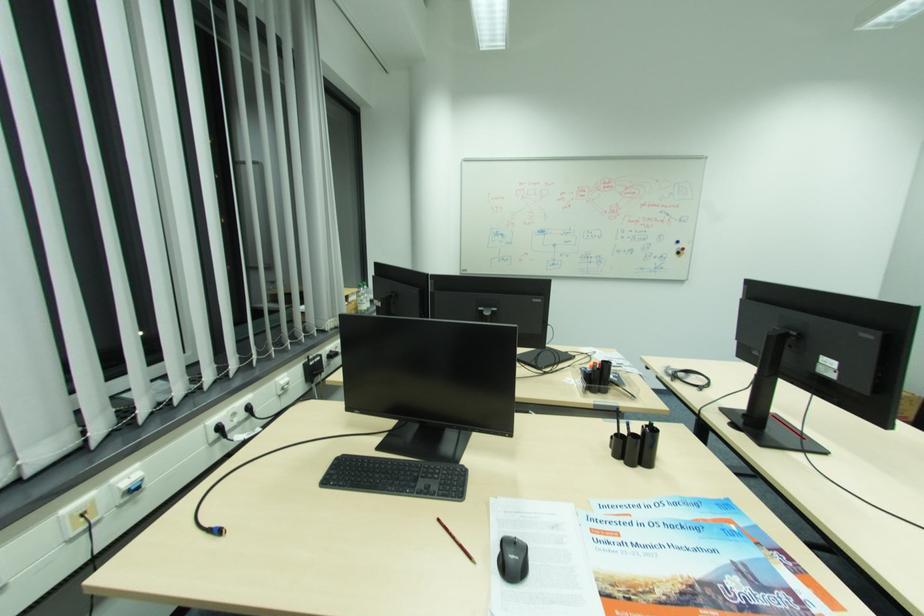
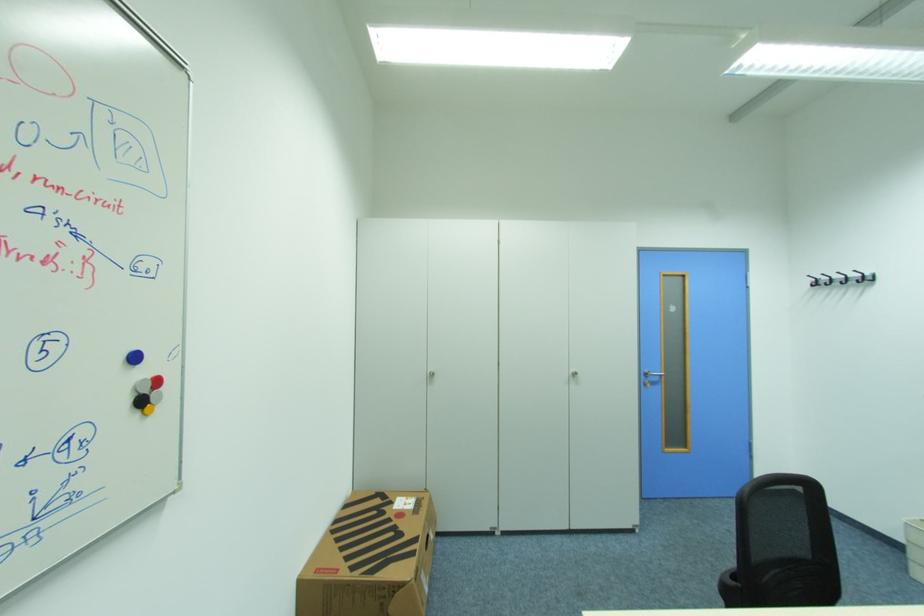
Find the pixel in the second image that matches point 684,253 in the first image.

(146, 403)